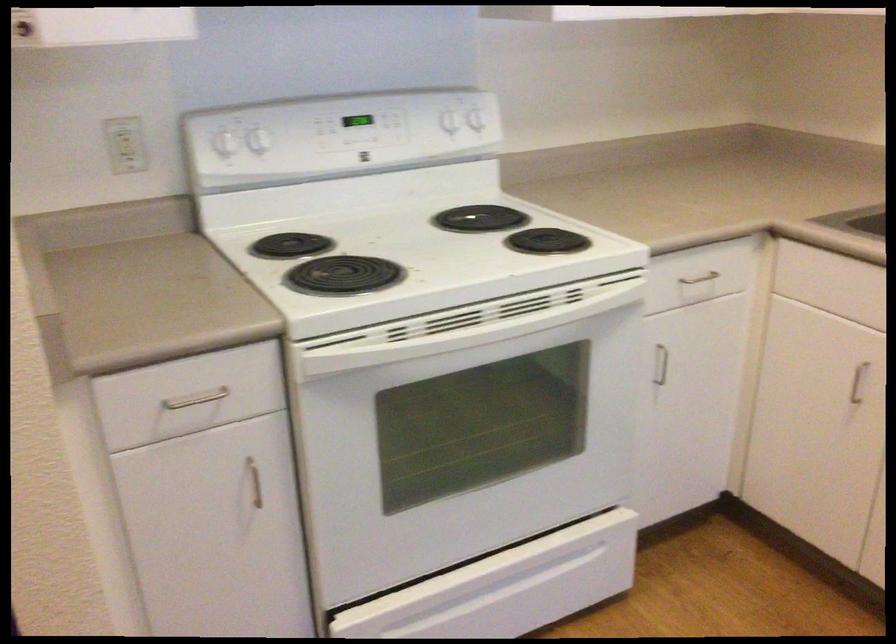
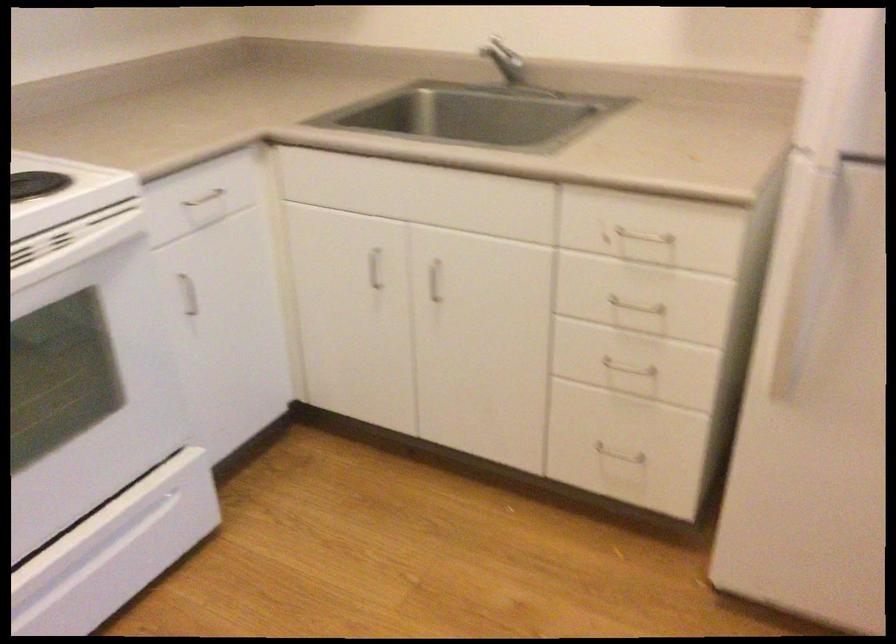
Where in the second image is the point corresponding to point (581, 305) from the first image?

(73, 243)